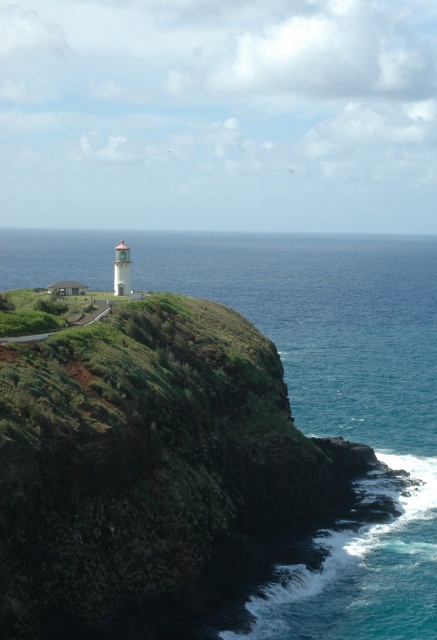
You are a hiker who wants to take a photo of the blue water at lower right and the green grassy shoreline at lower left. Which one is wider in the image?

The blue water at lower right is wider than the green grassy shoreline at lower left according to the description.

You are standing at the base of the cliff near the blue water at lower right. You want to take a photo of the lighthouse. Which direction should you face to capture the lighthouse in your shot?

To capture the lighthouse in your photo while standing at the base of the cliff near the blue water at lower right, you should face towards the cliff where the lighthouse is situated. The lighthouse is located atop the rugged cliff, which is opposite the blue water at lower right.